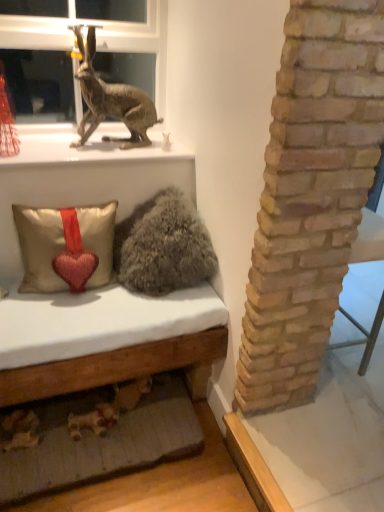
Image resolution: width=384 pixels, height=512 pixels. Identify the location of metallic rabbit at upper left. (111, 99).

Locate an element on the screen. metallic gold statue at upper left is located at coordinates (87, 146).

The width and height of the screenshot is (384, 512). Identify the location of satin beige pillow with heart at lower left. (65, 247).

From the picture: Looking at their sizes, would you say metallic rabbit at upper left is wider or thinner than metallic gold statue at upper left?

In the image, metallic rabbit at upper left appears to be more narrow than metallic gold statue at upper left.

Is metallic rabbit at upper left inside the boundaries of metallic gold statue at upper left, or outside?

metallic rabbit at upper left is spatially situated outside metallic gold statue at upper left.

Is metallic rabbit at upper left oriented towards metallic gold statue at upper left?

Yes, metallic rabbit at upper left is oriented towards metallic gold statue at upper left.

Is metallic rabbit at upper left beside metallic gold statue at upper left?

metallic rabbit at upper left and metallic gold statue at upper left are not in contact.

From a real-world perspective, is metallic rabbit at upper left located higher than fuzzy gray pillow at center?

Yes, from a real-world perspective, metallic rabbit at upper left is over fuzzy gray pillow at center

Is metallic rabbit at upper left next to fuzzy gray pillow at center and touching it?

No, metallic rabbit at upper left is not with fuzzy gray pillow at center.

Would you say metallic rabbit at upper left is outside fuzzy gray pillow at center?

metallic rabbit at upper left lies outside fuzzy gray pillow at center's area.

Considering the sizes of objects metallic rabbit at upper left and fuzzy gray pillow at center in the image provided, who is smaller, metallic rabbit at upper left or fuzzy gray pillow at center?

metallic rabbit at upper left.

In terms of width, does metallic rabbit at upper left look wider or thinner when compared to metallic rabbit at upper left?

Clearly, metallic rabbit at upper left has more width compared to metallic rabbit at upper left.

Consider the image. Between metallic rabbit at upper left and metallic rabbit at upper left, which one appears on the right side from the viewer's perspective?

metallic rabbit at upper left.

Considering the sizes of objects metallic rabbit at upper left and metallic rabbit at upper left in the image provided, who is smaller, metallic rabbit at upper left or metallic rabbit at upper left?

With smaller size is metallic rabbit at upper left.

Is metallic rabbit at upper left surrounded by metallic rabbit at upper left?

No, metallic rabbit at upper left is located outside of metallic rabbit at upper left.

Considering the sizes of metallic rabbit at upper left and metallic rabbit at upper left in the image, is metallic rabbit at upper left taller or shorter than metallic rabbit at upper left?

Clearly, metallic rabbit at upper left is taller compared to metallic rabbit at upper left.

Is metallic rabbit at upper left looking in the opposite direction of metallic rabbit at upper left?

Yes.

In the scene shown: Is metallic rabbit at upper left not close to metallic rabbit at upper left?

No, there isn't a large distance between metallic rabbit at upper left and metallic rabbit at upper left.

Would you say metallic rabbit at upper left is inside or outside metallic rabbit at upper left?

metallic rabbit at upper left is spatially situated outside metallic rabbit at upper left.

Is metallic rabbit at upper left far away from fuzzy gray pillow at center?

No, metallic rabbit at upper left is not far from fuzzy gray pillow at center.

Is metallic rabbit at upper left to the left or to the right of fuzzy gray pillow at center in the image?

In the image, metallic rabbit at upper left appears on the left side of fuzzy gray pillow at center.

Is the depth of metallic rabbit at upper left greater than that of fuzzy gray pillow at center?

Yes, it is.

Where is `animal in front of the metallic rabbit at upper left`? animal in front of the metallic rabbit at upper left is located at coordinates click(x=163, y=246).

Is fuzzy gray pillow at center completely or partially outside of metallic rabbit at upper left?

Absolutely, fuzzy gray pillow at center is external to metallic rabbit at upper left.

Is fuzzy gray pillow at center positioned far away from metallic rabbit at upper left?

No, fuzzy gray pillow at center is in close proximity to metallic rabbit at upper left.

Considering the sizes of objects fuzzy gray pillow at center and metallic rabbit at upper left in the image provided, who is shorter, fuzzy gray pillow at center or metallic rabbit at upper left?

fuzzy gray pillow at center is shorter.

Measure the distance from fuzzy gray pillow at center to metallic rabbit at upper left.

fuzzy gray pillow at center is 33.07 inches away from metallic rabbit at upper left.

Identify the location of window sill positioned vertically above the satin beige pillow with heart at lower left (from a real-world perspective). (87, 146).

Consider the image. How far apart are metallic gold statue at upper left and satin beige pillow with heart at lower left?

They are 13.79 inches apart.

In terms of width, does metallic gold statue at upper left look wider or thinner when compared to satin beige pillow with heart at lower left?

Clearly, metallic gold statue at upper left has more width compared to satin beige pillow with heart at lower left.

Identify the location of window sill directly beneath the metallic rabbit at upper left (from a real-world perspective). Image resolution: width=384 pixels, height=512 pixels. (87, 146).

Locate an element on the screen. This screenshot has width=384, height=512. rabbit lying behind the fuzzy gray pillow at center is located at coordinates (111, 99).

Which object lies nearer to the anchor point metallic rabbit at upper left, fuzzy gray pillow at center or satin beige pillow with heart at lower left?

Based on the image, fuzzy gray pillow at center appears to be nearer to metallic rabbit at upper left.

Looking at the image, which one is located closer to fuzzy gray pillow at center, metallic rabbit at upper left or metallic gold statue at upper left?

metallic gold statue at upper left.

Considering their positions, is fuzzy gray pillow at center positioned further to satin beige pillow with heart at lower left than metallic rabbit at upper left?

Based on the image, metallic rabbit at upper left appears to be further to satin beige pillow with heart at lower left.

Based on their spatial positions, is metallic gold statue at upper left or metallic rabbit at upper left further from metallic rabbit at upper left?

The object further to metallic rabbit at upper left is metallic rabbit at upper left.

Looking at the image, which one is located further to satin beige pillow with heart at lower left, metallic rabbit at upper left or metallic gold statue at upper left?

metallic rabbit at upper left is positioned further to the anchor satin beige pillow with heart at lower left.

Looking at the image, which one is located closer to metallic rabbit at upper left, metallic gold statue at upper left or metallic rabbit at upper left?

Based on the image, metallic rabbit at upper left appears to be nearer to metallic rabbit at upper left.

Estimate the real-world distances between objects in this image. Which object is closer to metallic rabbit at upper left, metallic gold statue at upper left or satin beige pillow with heart at lower left?

Based on the image, metallic gold statue at upper left appears to be nearer to metallic rabbit at upper left.

Estimate the real-world distances between objects in this image. Which object is closer to satin beige pillow with heart at lower left, metallic rabbit at upper left or metallic rabbit at upper left?

metallic rabbit at upper left.

The height and width of the screenshot is (512, 384). I want to click on animal between metallic gold statue at upper left and satin beige pillow with heart at lower left vertically, so click(x=163, y=246).

The width and height of the screenshot is (384, 512). I want to click on rabbit that lies between metallic rabbit at upper left and metallic gold statue at upper left from top to bottom, so click(x=111, y=99).

Where is `animal between metallic rabbit at upper left and satin beige pillow with heart at lower left from top to bottom`? This screenshot has width=384, height=512. animal between metallic rabbit at upper left and satin beige pillow with heart at lower left from top to bottom is located at coordinates 163,246.

Image resolution: width=384 pixels, height=512 pixels. In order to click on window sill between metallic rabbit at upper left and satin beige pillow with heart at lower left vertically in this screenshot , I will do `click(87, 146)`.